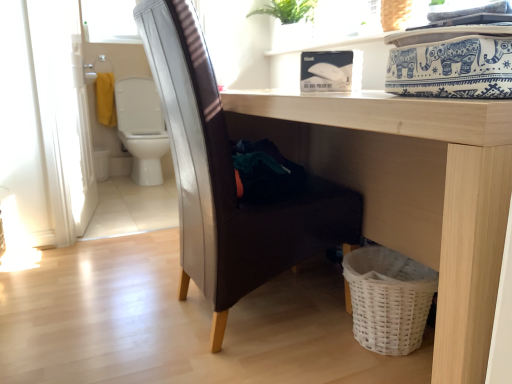
Question: From the image's perspective, is transparent glass window screen at upper left above white glossy screen door at left?

Choices:
 (A) yes
 (B) no

Answer: (A)

Question: Can you confirm if transparent glass window screen at upper left is shorter than white glossy screen door at left?

Choices:
 (A) no
 (B) yes

Answer: (B)

Question: Is transparent glass window screen at upper left closer to camera compared to white glossy screen door at left?

Choices:
 (A) yes
 (B) no

Answer: (B)

Question: From a real-world perspective, does transparent glass window screen at upper left stand above white glossy screen door at left?

Choices:
 (A) no
 (B) yes

Answer: (B)

Question: Does transparent glass window screen at upper left have a greater width compared to white glossy screen door at left?

Choices:
 (A) no
 (B) yes

Answer: (B)

Question: Does transparent glass window screen at upper left contain white glossy screen door at left?

Choices:
 (A) yes
 (B) no

Answer: (B)

Question: From a real-world perspective, does white glossy toilet at left stand above light wood table at lower center?

Choices:
 (A) yes
 (B) no

Answer: (A)

Question: From the image's perspective, is white glossy toilet at left beneath light wood table at lower center?

Choices:
 (A) no
 (B) yes

Answer: (A)

Question: Could you tell me if white glossy toilet at left is facing light wood table at lower center?

Choices:
 (A) no
 (B) yes

Answer: (B)

Question: Is white glossy toilet at left located outside light wood table at lower center?

Choices:
 (A) no
 (B) yes

Answer: (B)

Question: Considering the relative sizes of white glossy toilet at left and light wood table at lower center in the image provided, is white glossy toilet at left wider than light wood table at lower center?

Choices:
 (A) yes
 (B) no

Answer: (B)

Question: Can you confirm if white glossy toilet at left is smaller than light wood table at lower center?

Choices:
 (A) yes
 (B) no

Answer: (A)

Question: From the image's perspective, is leather-like brown chair at center located beneath light wood table at lower center?

Choices:
 (A) yes
 (B) no

Answer: (B)